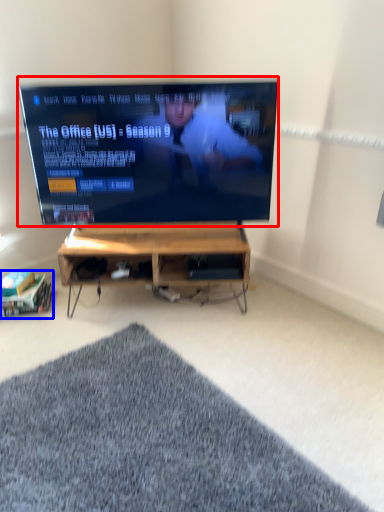
Question: Which object appears closest to the camera in this image, television (highlighted by a red box) or shelf (highlighted by a blue box)?

Choices:
 (A) television
 (B) shelf

Answer: (A)